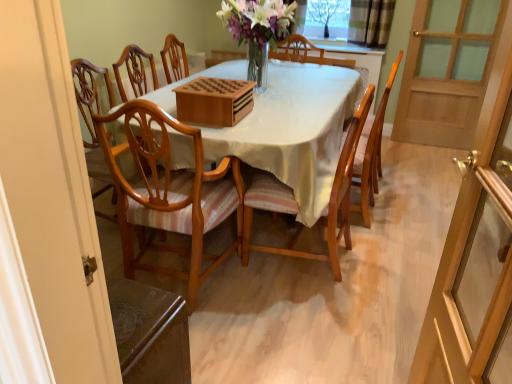
Question: Should I look upward or downward to see transparent glass screen door at right, which appears as the second screen door when viewed from the back?

Choices:
 (A) down
 (B) up

Answer: (A)

Question: Is transparent glass tree at upper center positioned with its back to translucent glass vase at center?

Choices:
 (A) yes
 (B) no

Answer: (B)

Question: Considering the relative sizes of transparent glass tree at upper center and translucent glass vase at center in the image provided, is transparent glass tree at upper center wider than translucent glass vase at center?

Choices:
 (A) yes
 (B) no

Answer: (B)

Question: Can you confirm if transparent glass tree at upper center is smaller than translucent glass vase at center?

Choices:
 (A) no
 (B) yes

Answer: (B)

Question: Does transparent glass tree at upper center have a lesser width compared to translucent glass vase at center?

Choices:
 (A) no
 (B) yes

Answer: (B)

Question: From a real-world perspective, is transparent glass tree at upper center below translucent glass vase at center?

Choices:
 (A) yes
 (B) no

Answer: (A)

Question: From the image's perspective, is transparent glass tree at upper center below translucent glass vase at center?

Choices:
 (A) yes
 (B) no

Answer: (B)

Question: Could wooden screen door at right, which ranks as the first screen door in back-to-front order, be considered to be inside transparent glass tree at upper center?

Choices:
 (A) yes
 (B) no

Answer: (B)

Question: Can you confirm if transparent glass tree at upper center is bigger than wooden screen door at right, acting as the first screen door starting from the right?

Choices:
 (A) yes
 (B) no

Answer: (B)

Question: Is transparent glass tree at upper center closer to the viewer compared to wooden screen door at right, which ranks as the first screen door in back-to-front order?

Choices:
 (A) no
 (B) yes

Answer: (A)

Question: Is transparent glass tree at upper center looking in the opposite direction of wooden screen door at right, which ranks as the first screen door in back-to-front order?

Choices:
 (A) yes
 (B) no

Answer: (B)

Question: Considering the relative positions of transparent glass tree at upper center and wooden screen door at right, positioned as the 2th screen door in left-to-right order, in the image provided, is transparent glass tree at upper center behind wooden screen door at right, positioned as the 2th screen door in left-to-right order,?

Choices:
 (A) yes
 (B) no

Answer: (A)

Question: Is transparent glass tree at upper center oriented towards wooden screen door at right, marked as the 2th screen door in a front-to-back arrangement?

Choices:
 (A) no
 (B) yes

Answer: (A)

Question: Does transparent glass screen door at right, the 1th screen door in the bottom-to-top sequence, have a lesser width compared to wooden screen door at right, acting as the first screen door starting from the right?

Choices:
 (A) yes
 (B) no

Answer: (A)